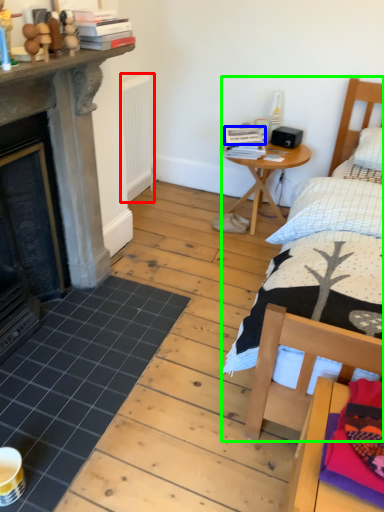
Question: Based on their relative distances, which object is nearer to radiator (highlighted by a red box)? Choose from book (highlighted by a blue box) and bed (highlighted by a green box).

Choices:
 (A) book
 (B) bed

Answer: (A)